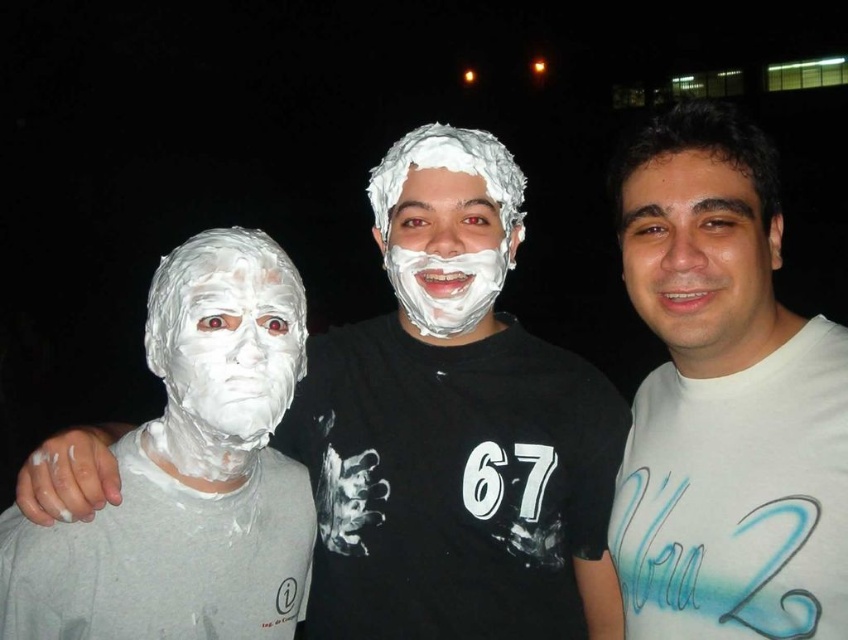
Question: Which object appears closest to the camera in this image?

Choices:
 (A) white matte shaving cream at left
 (B) smooth skin face at center
 (C) white matte face paint at left

Answer: (A)

Question: Can you confirm if smooth skin face at center is wider than white foam face at center?

Choices:
 (A) no
 (B) yes

Answer: (A)

Question: Is white matte face paint at left thinner than white matte shaving cream at left?

Choices:
 (A) no
 (B) yes

Answer: (A)

Question: Which object is farther from the camera taking this photo?

Choices:
 (A) white foam face at center
 (B) white matte shirt at center
 (C) white matte shaving cream at left
 (D) smooth skin face at center

Answer: (A)

Question: Which point appears closest to the camera in this image?

Choices:
 (A) (227, 300)
 (B) (484, 189)

Answer: (A)

Question: Does white matte face paint at left have a lesser width compared to white foam face at center?

Choices:
 (A) yes
 (B) no

Answer: (B)